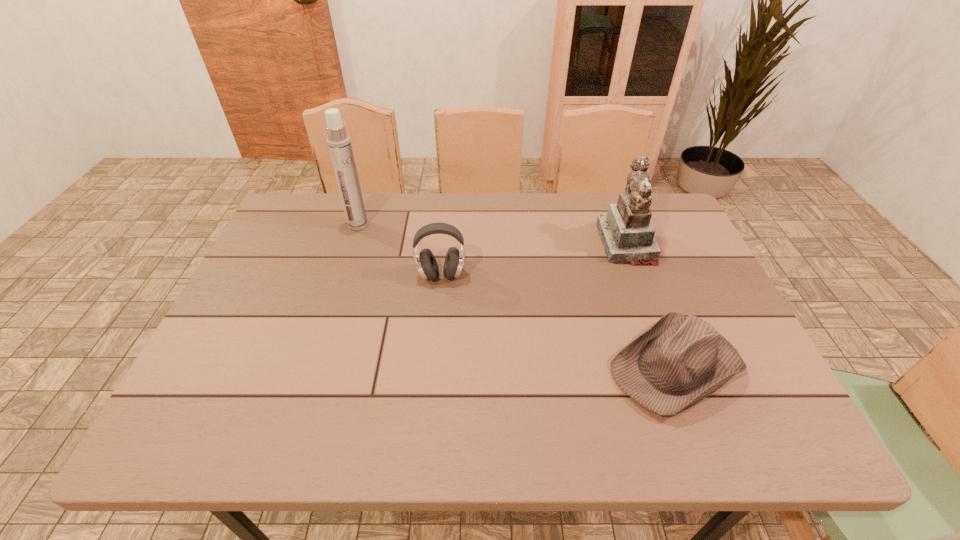
In order to click on vacant space situated 0.150m on the front-facing side of the third shortest object in this screenshot , I will do `click(548, 244)`.

This screenshot has height=540, width=960. In order to click on vacant space located 0.070m on the ear cups of the second object from left to right in this screenshot , I will do `click(439, 307)`.

Find the location of a particular element. Image resolution: width=960 pixels, height=540 pixels. free space located on the back of the fedora is located at coordinates [x=641, y=276].

Identify the location of aerosol can at the far edge. The width and height of the screenshot is (960, 540). (339, 143).

The width and height of the screenshot is (960, 540). I want to click on figurine positioned at the far edge, so click(x=627, y=234).

What are the coordinates of `object located at the near edge` in the screenshot? It's located at (680, 360).

The image size is (960, 540). What are the coordinates of `figurine that is positioned at the right edge` in the screenshot? It's located at (627, 234).

Find the location of a particular element. Image resolution: width=960 pixels, height=540 pixels. fedora that is positioned at the right edge is located at coordinates (x=680, y=360).

At what (x,y) coordinates should I click in order to perform the action: click on object present at the far right corner. Please return your answer as a coordinate pair (x, y). This screenshot has width=960, height=540. Looking at the image, I should click on (627, 234).

The height and width of the screenshot is (540, 960). I want to click on object that is at the near right corner, so click(x=680, y=360).